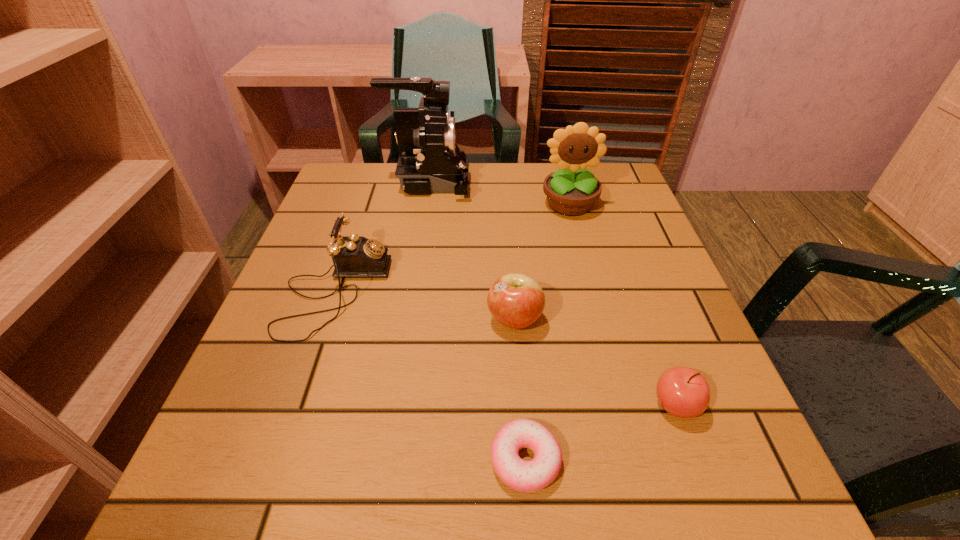
You are a GUI agent. You are given a task and a screenshot of the screen. Output one action in this format:
    pyautogui.click(x=<x>, y=<y>)
    Task: Click on the free space between the farther apple and the camcorder
    This screenshot has width=960, height=540.
    Given the screenshot: What is the action you would take?
    (x=471, y=251)

Identify the location of vacant space that's between the doughnut and the sunflower. (547, 332).

The height and width of the screenshot is (540, 960). Identify the location of vacant space that's between the fourth shortest object and the second nearest object. (505, 348).

The width and height of the screenshot is (960, 540). Identify the location of vacant area that lies between the farther apple and the fourth shortest object. (424, 306).

You are a GUI agent. You are given a task and a screenshot of the screen. Output one action in this format:
    pyautogui.click(x=<x>, y=<y>)
    Task: Click on the vacant space that's between the camcorder and the left apple
    
    Given the screenshot: What is the action you would take?
    pyautogui.click(x=471, y=251)

Locate an element on the screen. The height and width of the screenshot is (540, 960). free space that is in between the tallest object and the sunflower is located at coordinates (498, 193).

You are a GUI agent. You are given a task and a screenshot of the screen. Output one action in this format:
    pyautogui.click(x=<x>, y=<y>)
    Task: Click on the vacant area that lies between the nearer apple and the telephone
    Image resolution: width=960 pixels, height=540 pixels.
    Given the screenshot: What is the action you would take?
    pyautogui.click(x=505, y=348)

You are a GUI agent. You are given a task and a screenshot of the screen. Output one action in this format:
    pyautogui.click(x=<x>, y=<y>)
    Task: Click on the free point between the camcorder and the nearest object
    
    Given the screenshot: What is the action you would take?
    pyautogui.click(x=477, y=321)

In order to click on object that stands as the closest to the shortest object in this screenshot , I will do `click(683, 392)`.

The image size is (960, 540). I want to click on object that stands as the closest to the shortest object, so click(x=683, y=392).